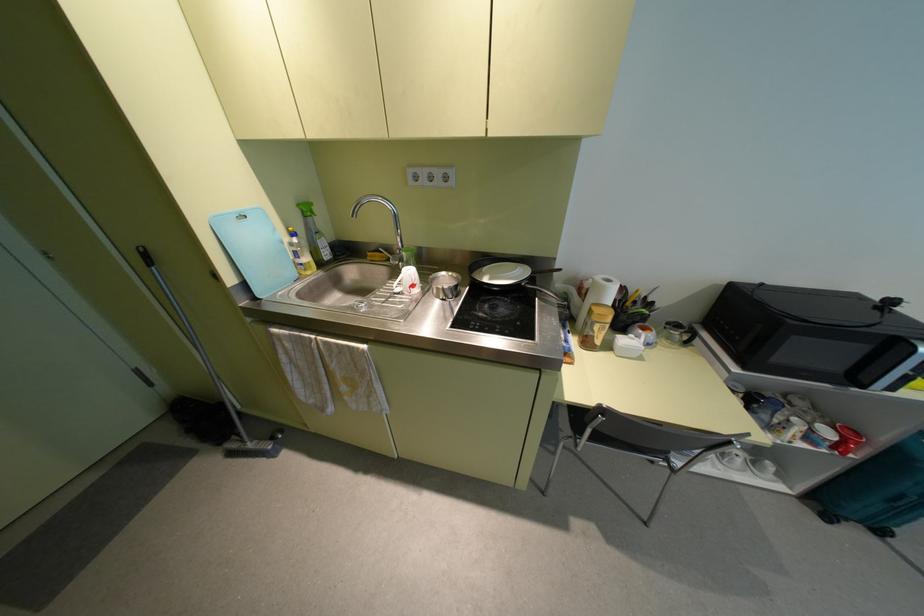
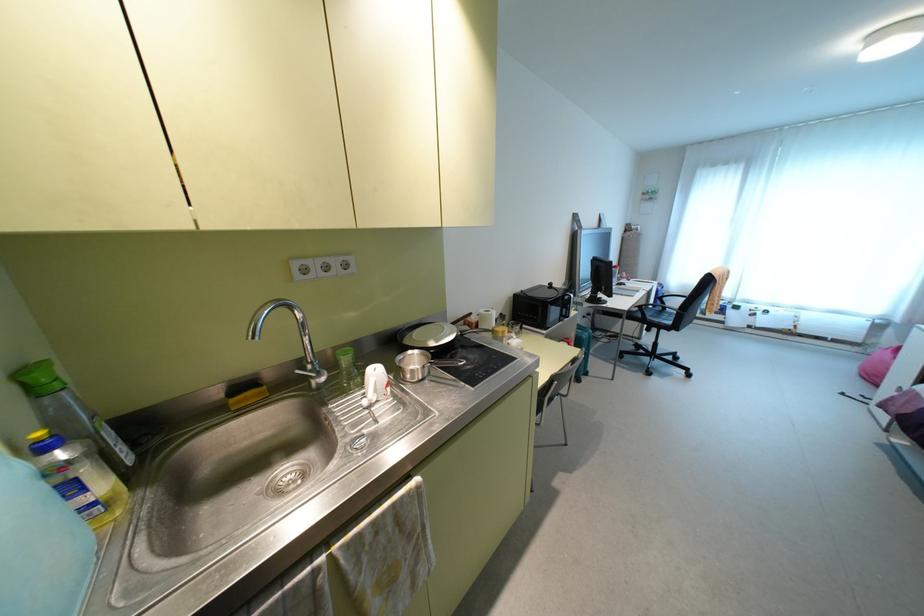
Locate, in the second image, the point that corresponds to point (490, 278) in the first image.

(435, 341)